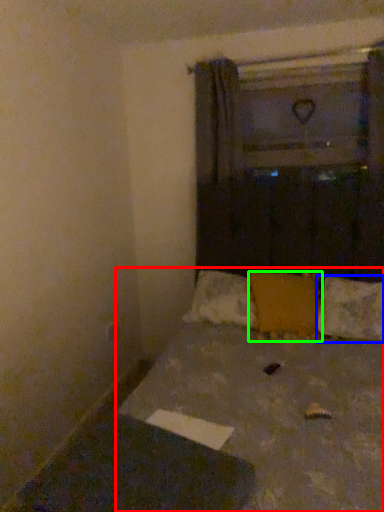
Question: Which object is positioned farthest from bed (highlighted by a red box)? Select from pillow (highlighted by a blue box) and pillow (highlighted by a green box).

Choices:
 (A) pillow
 (B) pillow

Answer: (A)